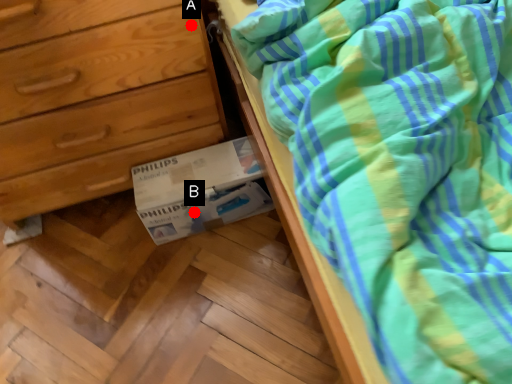
Question: Two points are circled on the image, labeled by A and B beside each circle. Which point is closer to the camera?

Choices:
 (A) A is closer
 (B) B is closer

Answer: (A)